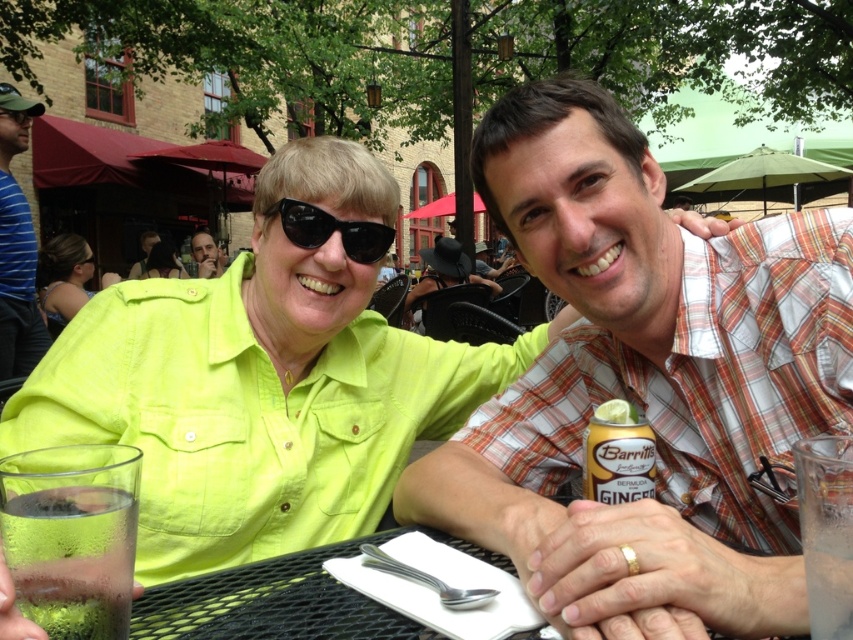
Is blue striped shirt at left bigger than matte black sunglasses at upper left?

Actually, blue striped shirt at left might be smaller than matte black sunglasses at upper left.

Who is more distant from viewer, (21, 276) or (190, 241)?

The point (190, 241) is more distant.

At what (x,y) coordinates should I click in order to perform the action: click on blue striped shirt at left. Please return your answer as a coordinate pair (x, y). Looking at the image, I should click on (16, 244).

Does clear glass at lower left come in front of matte black sunglasses at upper left?

Yes, it is in front of matte black sunglasses at upper left.

Does point (125, 598) lie in front of point (207, 273)?

Yes, point (125, 598) is closer to viewer.

Where is `clear glass at lower left`? The width and height of the screenshot is (853, 640). clear glass at lower left is located at coordinates (73, 557).

Between point (85, 586) and point (323, 240), which one is positioned behind?

The point (323, 240) is more distant.

Locate an element on the screen. clear glass at lower left is located at coordinates (73, 557).